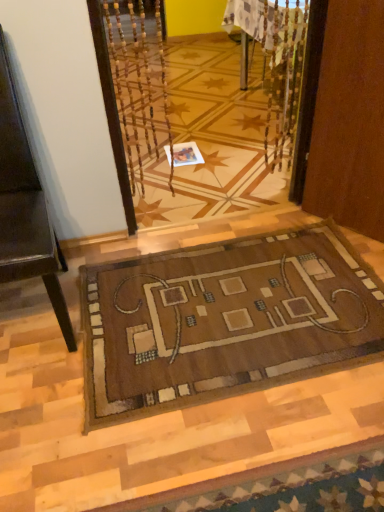
Question: Is white paper at center to the left or to the right of brown woven mat at center in the image?

Choices:
 (A) left
 (B) right

Answer: (A)

Question: From a real-world perspective, is white paper at center physically located above or below brown woven mat at center?

Choices:
 (A) below
 (B) above

Answer: (A)

Question: Which object is the farthest from the brown woven mat at center?

Choices:
 (A) white paper at center
 (B) brown leather chair at left

Answer: (A)

Question: Which is nearer to the white paper at center?

Choices:
 (A) brown woven mat at center
 (B) brown leather chair at left

Answer: (A)